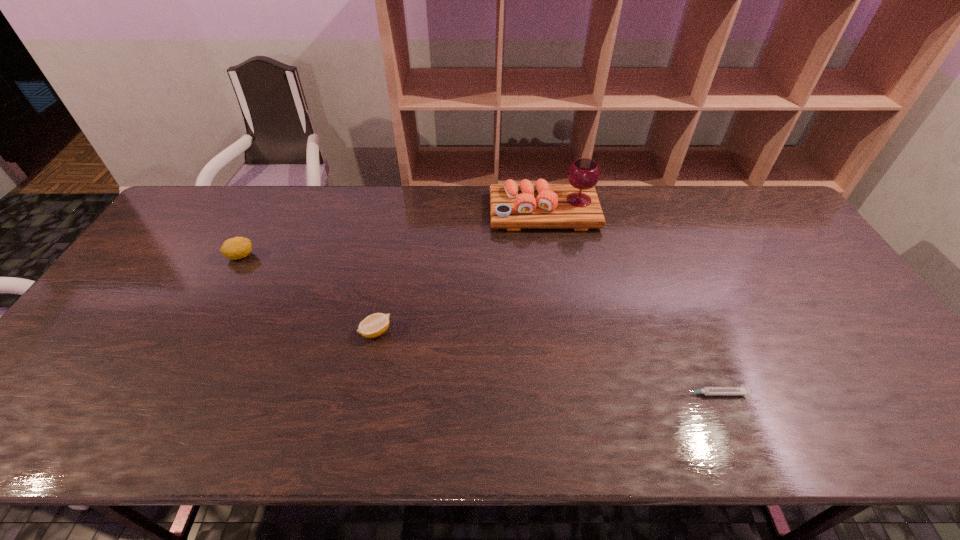
Find the location of a particular element. object that is the closest to the platter is located at coordinates (374, 325).

Where is `vacant space that satisfies the following two spatial constraints: 1. at the stem end of the second farthest object; 2. on the back side of the right lemon`? vacant space that satisfies the following two spatial constraints: 1. at the stem end of the second farthest object; 2. on the back side of the right lemon is located at coordinates (199, 332).

I want to click on free point that satisfies the following two spatial constraints: 1. at the stem end of the second nearest object; 2. on the left side of the left lemon, so click(x=199, y=332).

Locate an element on the screen. This screenshot has width=960, height=540. free location that satisfies the following two spatial constraints: 1. at the stem end of the farther lemon; 2. on the back side of the third object from right to left is located at coordinates (199, 332).

Identify the location of free space that satisfies the following two spatial constraints: 1. on the back side of the third farthest object; 2. at the stem end of the leftmost object. [392, 256].

You are a GUI agent. You are given a task and a screenshot of the screen. Output one action in this format:
    pyautogui.click(x=<x>, y=<y>)
    Task: Click on the free location that satisfies the following two spatial constraints: 1. on the back side of the third object from right to left; 2. at the stem end of the third nearest object
    
    Given the screenshot: What is the action you would take?
    pyautogui.click(x=392, y=256)